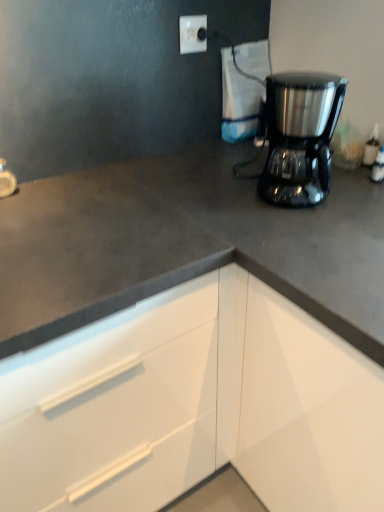
At what (x,y) coordinates should I click in order to perform the action: click on empty space that is in between satin black coffee maker at upper right and white glossy faucet at upper left. Please return your answer as a coordinate pair (x, y). Looking at the image, I should click on (149, 195).